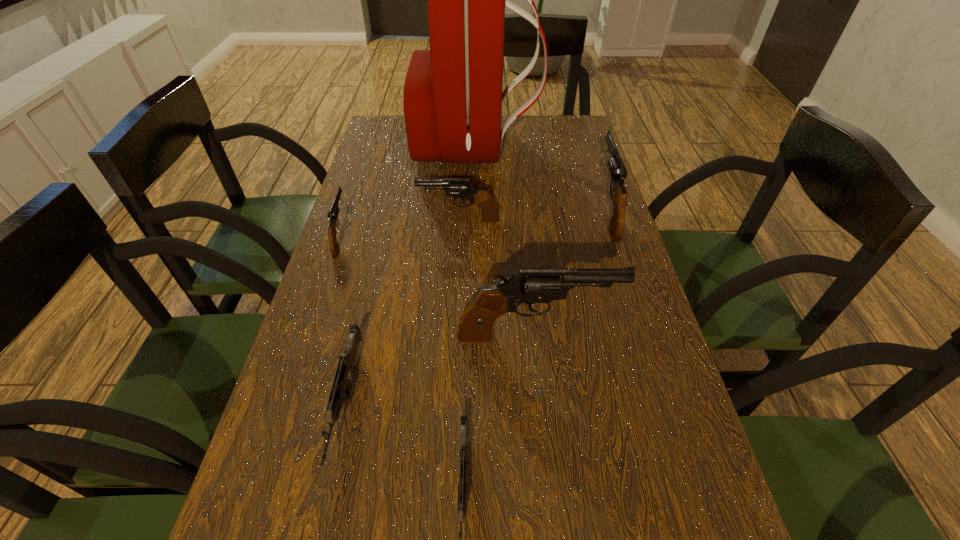
Identify the location of vacant area situated 0.340m along the barrel of the smallest black gun. This screenshot has height=540, width=960. (370, 152).

Identify the location of vacant position located 0.240m along the barrel of the smallest black gun. This screenshot has height=540, width=960. (364, 168).

Where is `blank space located aimed along the barrel of the second gun from left to right`? This screenshot has height=540, width=960. blank space located aimed along the barrel of the second gun from left to right is located at coordinates (319, 523).

Locate an element on the screen. object situated at the far edge is located at coordinates (452, 99).

Find the location of a particular element. backpack that is at the left edge is located at coordinates (452, 99).

Locate an element on the screen. Image resolution: width=960 pixels, height=540 pixels. object present at the far left corner is located at coordinates (452, 99).

Locate an element on the screen. The width and height of the screenshot is (960, 540). vacant point at the far edge is located at coordinates (539, 132).

Identify the location of vacant space at the left edge of the desktop. (316, 381).

You are a GUI agent. You are given a task and a screenshot of the screen. Output one action in this format:
    pyautogui.click(x=<x>, y=<y>)
    Task: Click on the free space at the right edge of the desktop
    This screenshot has height=540, width=960.
    Given the screenshot: What is the action you would take?
    pyautogui.click(x=583, y=323)

What are the coordinates of `free space at the far right corner` in the screenshot? It's located at (588, 133).